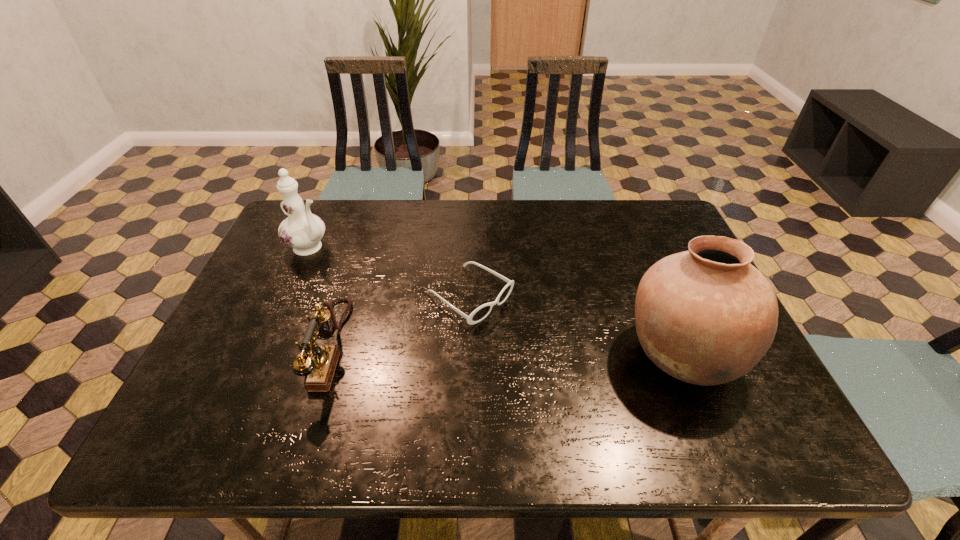
The height and width of the screenshot is (540, 960). Find the location of `the third object from right to left`. the third object from right to left is located at coordinates (319, 363).

In order to click on telephone in this screenshot , I will do `click(319, 363)`.

Where is `pottery`? pottery is located at coordinates (706, 316).

Locate an element on the screen. The height and width of the screenshot is (540, 960). the shortest object is located at coordinates 481,312.

You are a GUI agent. You are given a task and a screenshot of the screen. Output one action in this format:
    pyautogui.click(x=<x>, y=<y>)
    Task: Click on the third object from left to right
    The width and height of the screenshot is (960, 540).
    Given the screenshot: What is the action you would take?
    pyautogui.click(x=481, y=312)

Locate an element on the screen. The width and height of the screenshot is (960, 540). the leftmost object is located at coordinates (302, 231).

Identify the location of chinaware. (302, 231).

Identify the location of free spot located 0.200m on the front-facing side of the telephone. The height and width of the screenshot is (540, 960). (230, 346).

This screenshot has width=960, height=540. Find the location of `vacant space positioned 0.140m on the front-facing side of the telephone`. vacant space positioned 0.140m on the front-facing side of the telephone is located at coordinates (255, 346).

The width and height of the screenshot is (960, 540). In order to click on free space located 0.090m on the front-facing side of the telephone in this screenshot , I will do `click(276, 346)`.